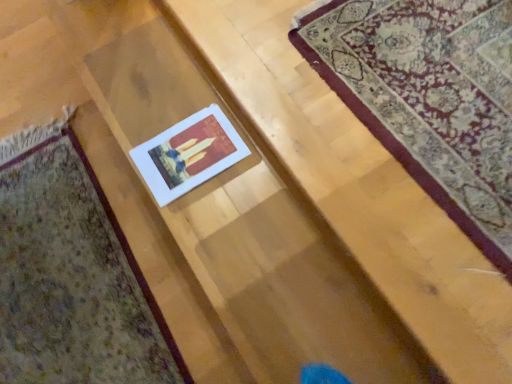
Question: Can you confirm if white paper at center is bigger than matte paper card at center?

Choices:
 (A) yes
 (B) no

Answer: (B)

Question: From a real-world perspective, is white paper at center beneath matte paper card at center?

Choices:
 (A) no
 (B) yes

Answer: (A)

Question: From a real-world perspective, is white paper at center on top of matte paper card at center?

Choices:
 (A) yes
 (B) no

Answer: (A)

Question: Could you tell me if white paper at center is facing matte paper card at center?

Choices:
 (A) yes
 (B) no

Answer: (B)

Question: Considering the relative sizes of white paper at center and matte paper card at center in the image provided, is white paper at center smaller than matte paper card at center?

Choices:
 (A) yes
 (B) no

Answer: (A)

Question: Would you say matte paper card at center is to the left or to the right of white paper at center in the picture?

Choices:
 (A) right
 (B) left

Answer: (B)

Question: Is matte paper card at center spatially inside white paper at center, or outside of it?

Choices:
 (A) outside
 (B) inside

Answer: (A)

Question: Considering their positions, is matte paper card at center located in front of or behind white paper at center?

Choices:
 (A) behind
 (B) front

Answer: (B)

Question: From the image's perspective, is matte paper card at center above or below white paper at center?

Choices:
 (A) above
 (B) below

Answer: (B)

Question: From a real-world perspective, relative to matte paper card at center, is white paper at center vertically above or below?

Choices:
 (A) below
 (B) above

Answer: (B)

Question: Considering the positions of white paper at center and matte paper card at center in the image, is white paper at center wider or thinner than matte paper card at center?

Choices:
 (A) thin
 (B) wide

Answer: (A)

Question: Considering their positions, is white paper at center located in front of or behind matte paper card at center?

Choices:
 (A) behind
 (B) front

Answer: (A)

Question: Is white paper at center bigger or smaller than matte paper card at center?

Choices:
 (A) big
 (B) small

Answer: (B)

Question: Is white paper at center taller or shorter than matte paper card at center?

Choices:
 (A) short
 (B) tall

Answer: (B)

Question: Based on their positions, is white paper at center located to the left or right of matte paper card at center?

Choices:
 (A) left
 (B) right

Answer: (B)